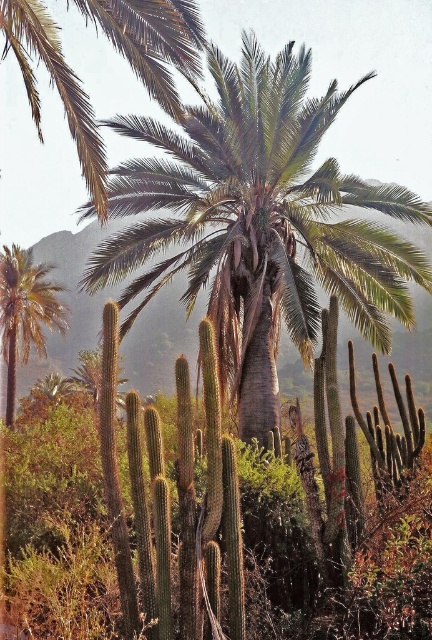
You are standing in the desert scene. There is a point at coordinates (259, 221). What object does this point correspond to?

The point at coordinates (259, 221) corresponds to the green leafy palm at center.